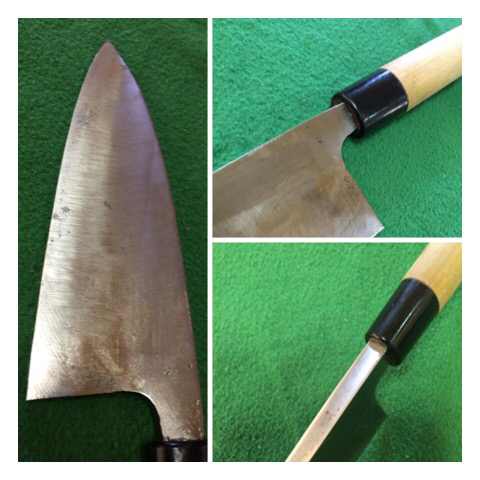
Image resolution: width=480 pixels, height=480 pixels. I want to click on three photographs, so tap(192, 81), tap(295, 83), tap(295, 317).